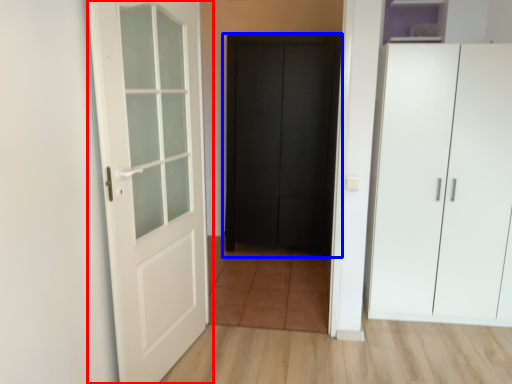
Question: Which object is further to the camera taking this photo, door (highlighted by a red box) or door (highlighted by a blue box)?

Choices:
 (A) door
 (B) door

Answer: (B)